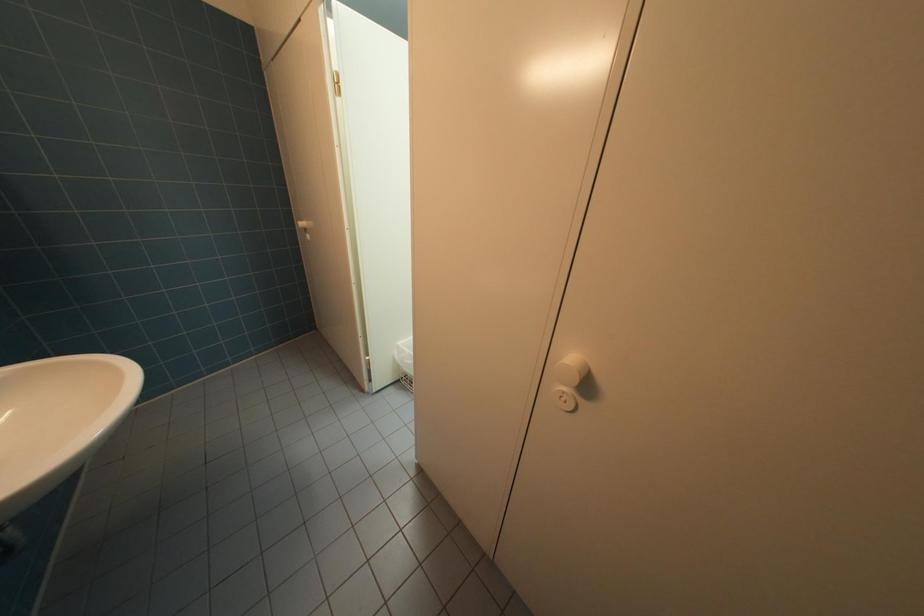
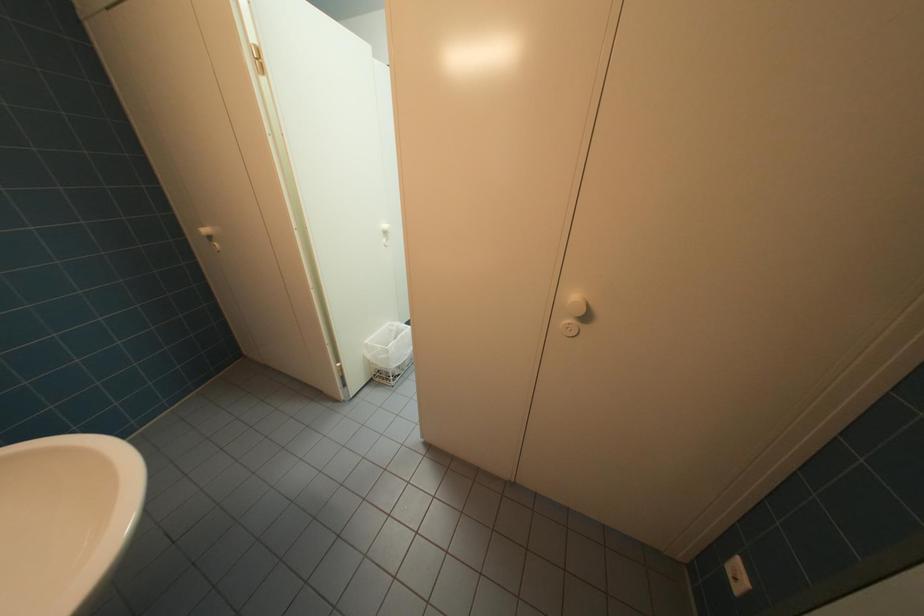
Question: How did the camera likely rotate?

Choices:
 (A) Left
 (B) Right
 (C) Up
 (D) Down

Answer: (B)